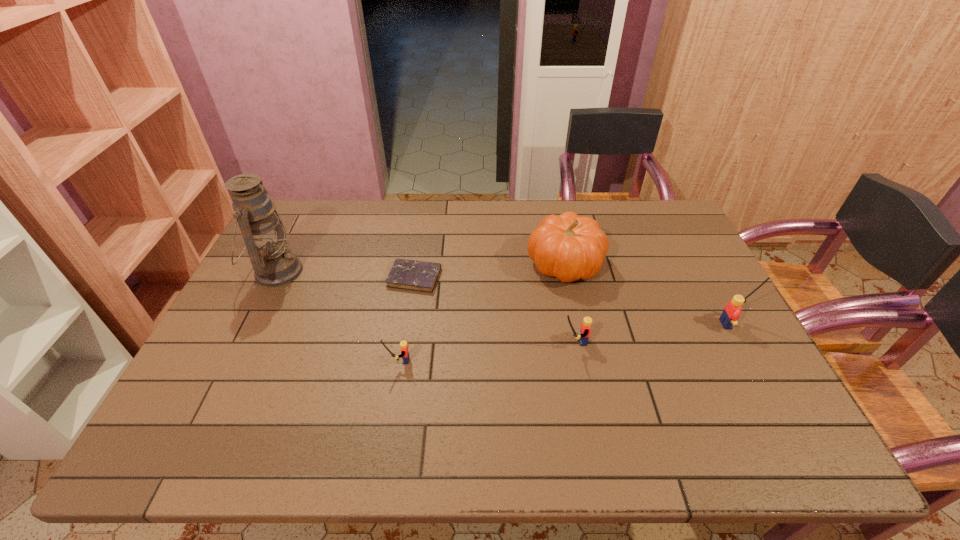
Where is `vacant area located 0.300m on the front-facing side of the nearest object`? vacant area located 0.300m on the front-facing side of the nearest object is located at coordinates (268, 360).

Where is `free spot located on the front-facing side of the nearest object`? This screenshot has width=960, height=540. free spot located on the front-facing side of the nearest object is located at coordinates (312, 360).

Locate an element on the screen. The image size is (960, 540). free location located on the front-facing side of the nearest object is located at coordinates (272, 360).

At what (x,y) coordinates should I click in order to perform the action: click on free location located 0.140m on the front-facing side of the fourth tallest object. Please return your answer as a coordinate pair (x, y). This screenshot has width=960, height=540. Looking at the image, I should click on (507, 341).

Locate an element on the screen. This screenshot has height=540, width=960. vacant space located 0.180m on the front-facing side of the fourth tallest object is located at coordinates (492, 341).

Locate an element on the screen. The width and height of the screenshot is (960, 540). free region located on the front-facing side of the fourth tallest object is located at coordinates (503, 341).

At what (x,y) coordinates should I click in order to perform the action: click on free space located 0.080m on the left of the diary. Please return your answer as a coordinate pair (x, y). Image resolution: width=960 pixels, height=540 pixels. Looking at the image, I should click on (362, 277).

Find the location of `vacant region located 0.280m on the left of the pumpkin`. vacant region located 0.280m on the left of the pumpkin is located at coordinates (436, 264).

This screenshot has height=540, width=960. Identify the location of vacant region located on the right of the tallest object. click(x=322, y=272).

This screenshot has width=960, height=540. I want to click on object at the far edge, so click(568, 247).